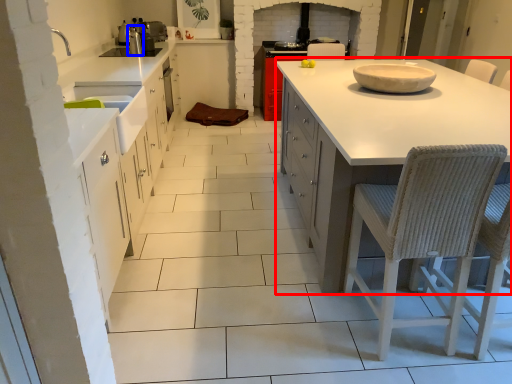
Question: Which of the following is the closest to the observer, countertop (highlighted by a red box) or appliance (highlighted by a blue box)?

Choices:
 (A) countertop
 (B) appliance

Answer: (A)